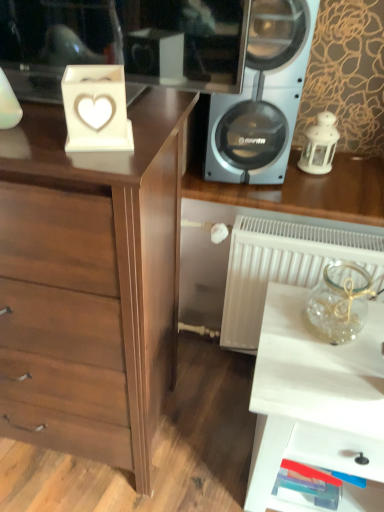
You are a GUI agent. You are given a task and a screenshot of the screen. Output one action in this format:
    pyautogui.click(x=<x>, y=<y>)
    Task: Click on the brown wood chest of drawers at left
    
    Given the screenshot: What is the action you would take?
    pyautogui.click(x=92, y=282)

The height and width of the screenshot is (512, 384). What do you see at coordinates (262, 97) in the screenshot?
I see `silver metallic speaker at upper right` at bounding box center [262, 97].

Image resolution: width=384 pixels, height=512 pixels. In order to click on clear glass jar at right in this screenshot , I will do `click(339, 302)`.

Find the location of `white matte heart-shaped object at upper left`. white matte heart-shaped object at upper left is located at coordinates (96, 108).

Is white matte heart-shaped object at upper left at the right side of white glossy table at lower right?

Incorrect, white matte heart-shaped object at upper left is not on the right side of white glossy table at lower right.

Who is taller, white matte heart-shaped object at upper left or white glossy table at lower right?

Standing taller between the two is white glossy table at lower right.

Is white matte heart-shaped object at upper left smaller than white glossy table at lower right?

Correct, white matte heart-shaped object at upper left occupies less space than white glossy table at lower right.

Is the surface of white matte heart-shaped object at upper left in direct contact with white glossy table at lower right?

No.

Measure the distance from brown wood chest of drawers at left to white glossy table at lower right.

18.12 inches.

Considering the sizes of objects brown wood chest of drawers at left and white glossy table at lower right in the image provided, who is thinner, brown wood chest of drawers at left or white glossy table at lower right?

Thinner between the two is white glossy table at lower right.

How many degrees apart are the facing directions of brown wood chest of drawers at left and white glossy table at lower right?

brown wood chest of drawers at left and white glossy table at lower right are facing 2.28 degrees away from each other.

Between brown wood chest of drawers at left and white glossy table at lower right, which one has more height?

brown wood chest of drawers at left is taller.

Is silver metallic speaker at upper right taller than white glossy table at lower right?

In fact, silver metallic speaker at upper right may be shorter than white glossy table at lower right.

Is silver metallic speaker at upper right at the right side of white glossy table at lower right?

Incorrect, silver metallic speaker at upper right is not on the right side of white glossy table at lower right.

Could you tell me if silver metallic speaker at upper right is turned towards white glossy table at lower right?

No, silver metallic speaker at upper right is not aimed at white glossy table at lower right.

Is silver metallic speaker at upper right bigger than white glossy table at lower right?

Actually, silver metallic speaker at upper right might be smaller than white glossy table at lower right.

Is clear glass jar at right next to brown wood chest of drawers at left and touching it?

No, clear glass jar at right is not in contact with brown wood chest of drawers at left.

Measure the distance from clear glass jar at right to brown wood chest of drawers at left.

clear glass jar at right and brown wood chest of drawers at left are 23.47 inches apart from each other.

At what (x,y) coordinates should I click in order to perform the action: click on glass vase that is above the brown wood chest of drawers at left (from a real-world perspective). Please return your answer as a coordinate pair (x, y). Looking at the image, I should click on (339, 302).

Is brown wood chest of drawers at left completely or partially inside clear glass jar at right?

That's incorrect, brown wood chest of drawers at left is not inside clear glass jar at right.

From a real-world perspective, is white porcelain lantern at right beneath silver metallic speaker at upper right?

Yes.

Who is shorter, white porcelain lantern at right or silver metallic speaker at upper right?

white porcelain lantern at right is shorter.

Based on their positions, is white porcelain lantern at right located to the left or right of silver metallic speaker at upper right?

In the image, white porcelain lantern at right appears on the right side of silver metallic speaker at upper right.

Does white porcelain lantern at right have a larger size compared to silver metallic speaker at upper right?

Incorrect, white porcelain lantern at right is not larger than silver metallic speaker at upper right.

Which is correct: white glossy table at lower right is inside white matte heart-shaped object at upper left, or outside of it?

white glossy table at lower right lies outside white matte heart-shaped object at upper left.

From the image's perspective, is white glossy table at lower right above white matte heart-shaped object at upper left?

Incorrect, from the image's perspective, white glossy table at lower right is lower than white matte heart-shaped object at upper left.

The image size is (384, 512). What are the coordinates of `table on the right of white matte heart-shaped object at upper left` in the screenshot? It's located at (314, 396).

Which point is more distant from viewer, (349,370) or (101,120)?

The point (349,370) is behind.

Does point (349, 384) appear closer or farther from the camera than point (325, 148)?

Point (349, 384).

Is white glossy table at lower right turned away from white porcelain lantern at right?

No, white glossy table at lower right is not facing away from white porcelain lantern at right.

How different are the orientations of white glossy table at lower right and white porcelain lantern at right in degrees?

6.78 degrees.

From the image's perspective, is white glossy table at lower right on white porcelain lantern at right?

Actually, white glossy table at lower right appears below white porcelain lantern at right in the image.

This screenshot has height=512, width=384. In order to click on table below the white matte heart-shaped object at upper left (from the image's perspective) in this screenshot , I will do `click(314, 396)`.

Identify the location of chest of drawers on the left of the white glossy table at lower right. (92, 282).

From the image, which object appears to be nearer to clear glass jar at right, brown wood chest of drawers at left or white matte heart-shaped object at upper left?

brown wood chest of drawers at left.

Based on their spatial positions, is white porcelain lantern at right or white matte heart-shaped object at upper left further from white glossy table at lower right?

white matte heart-shaped object at upper left.

Looking at the image, which one is located further to white matte heart-shaped object at upper left, clear glass jar at right or silver metallic speaker at upper right?

clear glass jar at right.

Looking at the image, which one is located closer to silver metallic speaker at upper right, white matte heart-shaped object at upper left or brown wood chest of drawers at left?

Among the two, brown wood chest of drawers at left is located nearer to silver metallic speaker at upper right.

Looking at the image, which one is located further to white porcelain lantern at right, clear glass jar at right or white matte heart-shaped object at upper left?

white matte heart-shaped object at upper left.

Considering their positions, is white glossy table at lower right positioned closer to brown wood chest of drawers at left than clear glass jar at right?

white glossy table at lower right is positioned closer to the anchor brown wood chest of drawers at left.

Based on their spatial positions, is white glossy table at lower right or silver metallic speaker at upper right closer to white porcelain lantern at right?

silver metallic speaker at upper right is positioned closer to the anchor white porcelain lantern at right.

Consider the image. Estimate the real-world distances between objects in this image. Which object is closer to clear glass jar at right, white matte heart-shaped object at upper left or white glossy table at lower right?

Based on the image, white glossy table at lower right appears to be nearer to clear glass jar at right.

This screenshot has height=512, width=384. Find the location of `home appliance between brown wood chest of drawers at left and white porcelain lantern at right`. home appliance between brown wood chest of drawers at left and white porcelain lantern at right is located at coordinates (262, 97).

Locate an element on the screen. Image resolution: width=384 pixels, height=512 pixels. appliance situated between brown wood chest of drawers at left and clear glass jar at right from left to right is located at coordinates (96, 108).

The image size is (384, 512). I want to click on appliance between silver metallic speaker at upper right and clear glass jar at right in the up-down direction, so click(x=96, y=108).

Identify the location of glass vase between white matte heart-shaped object at upper left and white glossy table at lower right from top to bottom. This screenshot has width=384, height=512. (339, 302).